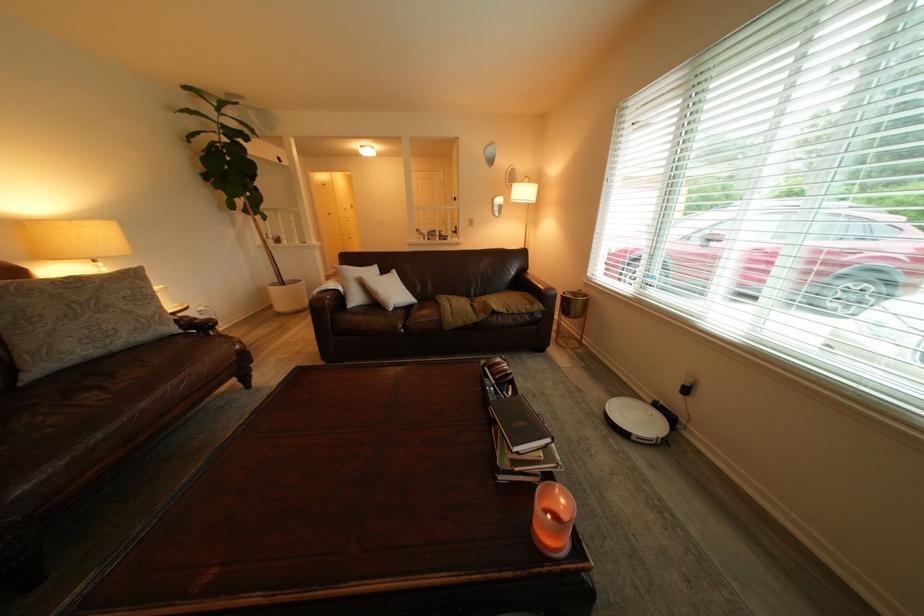
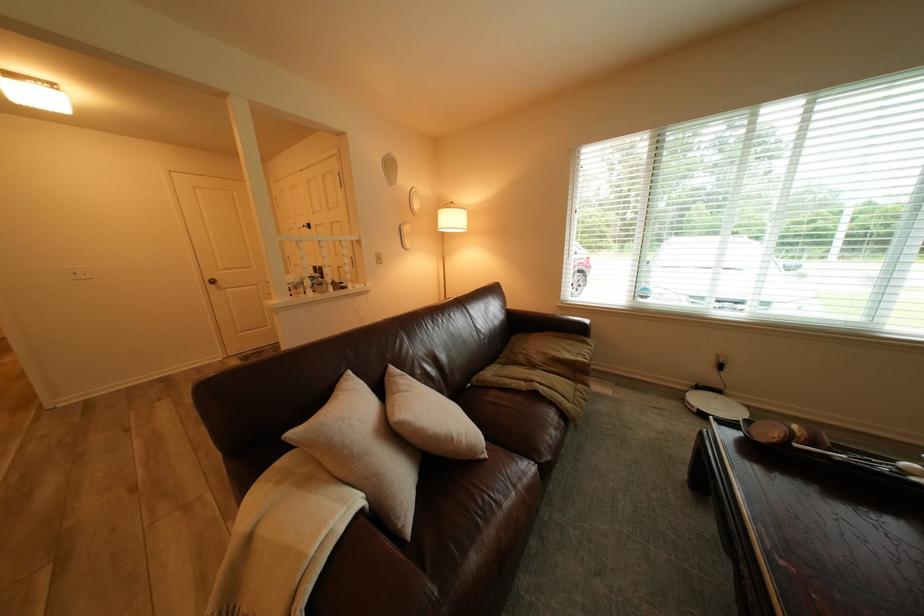
Locate, in the second image, the point that corresponds to pixel 354 290 in the first image.

(372, 500)